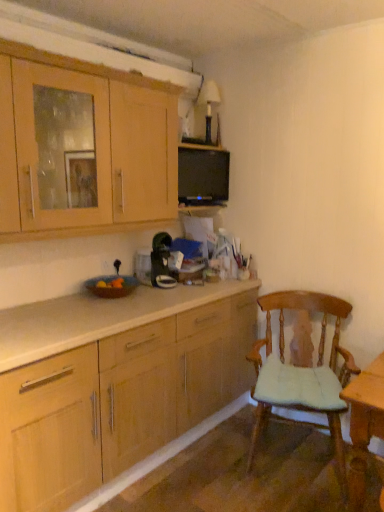
Question: From the image's perspective, is wooden chair with cushion at right located beneath wooden cabinet at upper left?

Choices:
 (A) yes
 (B) no

Answer: (A)

Question: From the image's perspective, would you say wooden chair with cushion at right is positioned over wooden cabinet at upper left?

Choices:
 (A) yes
 (B) no

Answer: (B)

Question: Can you confirm if wooden chair with cushion at right is shorter than wooden cabinet at upper left?

Choices:
 (A) no
 (B) yes

Answer: (A)

Question: Is wooden chair with cushion at right smaller than wooden cabinet at upper left?

Choices:
 (A) yes
 (B) no

Answer: (B)

Question: Is wooden chair with cushion at right taller than wooden cabinet at upper left?

Choices:
 (A) yes
 (B) no

Answer: (A)

Question: Does wooden chair with cushion at right lie in front of wooden cabinet at upper left?

Choices:
 (A) no
 (B) yes

Answer: (A)

Question: Considering the relative positions of wooden cabinet at upper left and wooden chair with cushion at right in the image provided, is wooden cabinet at upper left to the right of wooden chair with cushion at right from the viewer's perspective?

Choices:
 (A) no
 (B) yes

Answer: (A)

Question: Is wooden cabinet at upper left facing away from wooden chair with cushion at right?

Choices:
 (A) yes
 (B) no

Answer: (B)

Question: Is wooden cabinet at upper left positioned before wooden chair with cushion at right?

Choices:
 (A) yes
 (B) no

Answer: (A)

Question: From the image's perspective, does wooden cabinet at upper left appear higher than wooden chair with cushion at right?

Choices:
 (A) no
 (B) yes

Answer: (B)

Question: Is wooden cabinet at upper left not near wooden chair with cushion at right?

Choices:
 (A) yes
 (B) no

Answer: (A)

Question: Can wooden chair with cushion at right be found inside wooden cabinet at upper left?

Choices:
 (A) yes
 (B) no

Answer: (B)

Question: Is wooden chair with cushion at right wider or thinner than wooden cabinet at upper left?

Choices:
 (A) thin
 (B) wide

Answer: (B)